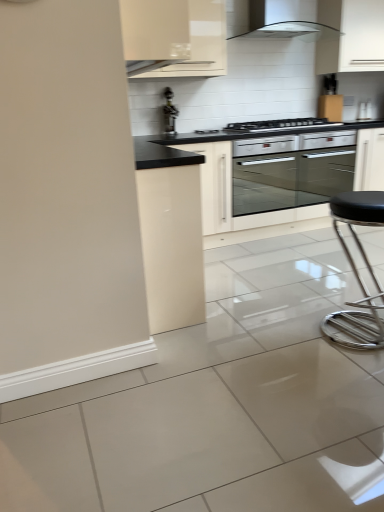
Question: In terms of width, does metallic gold faucet at upper center look wider or thinner when compared to metallic silver bar stool at right?

Choices:
 (A) thin
 (B) wide

Answer: (A)

Question: Is metallic gold faucet at upper center bigger or smaller than metallic silver bar stool at right?

Choices:
 (A) small
 (B) big

Answer: (A)

Question: Estimate the real-world distances between objects in this image. Which object is farther from the white glossy range hood at upper center?

Choices:
 (A) metallic silver bar stool at right
 (B) white glossy cabinet at upper right, arranged as the second cabinetry when viewed from the left
 (C) metallic gold faucet at upper center
 (D) satin silver oven at center
 (E) black glass cooktop at center

Answer: (A)

Question: Which object is the closest to the white glossy cabinet at upper right, arranged as the second cabinetry when viewed from the left?

Choices:
 (A) black glass cooktop at center
 (B) metallic silver bar stool at right
 (C) satin silver oven at center
 (D) white glossy range hood at upper center
 (E) white glossy cabinet at upper center, the 1th cabinetry from the left

Answer: (D)